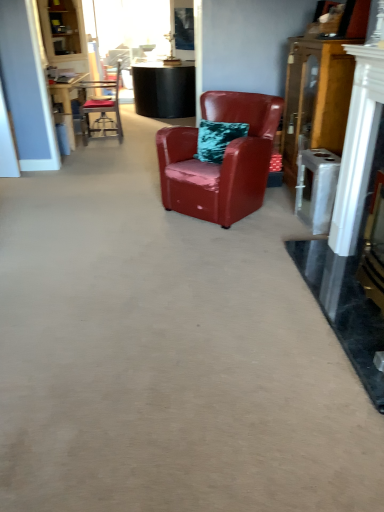
Question: From the image's perspective, is wooden cabinet at right above glossy leather armchair at center, which appears as the 2th chair when viewed from the back?

Choices:
 (A) no
 (B) yes

Answer: (B)

Question: Considering the relative sizes of wooden cabinet at right and glossy leather armchair at center, the 2th chair when ordered from left to right, in the image provided, is wooden cabinet at right smaller than glossy leather armchair at center, the 2th chair when ordered from left to right,?

Choices:
 (A) no
 (B) yes

Answer: (B)

Question: Is wooden cabinet at right to the left of glossy leather armchair at center, which is the first chair in right-to-left order, from the viewer's perspective?

Choices:
 (A) yes
 (B) no

Answer: (B)

Question: From a real-world perspective, is wooden cabinet at right over glossy leather armchair at center, the 2th chair when ordered from left to right?

Choices:
 (A) yes
 (B) no

Answer: (A)

Question: Is wooden cabinet at right behind glossy leather armchair at center, marked as the 2th chair in a top-to-bottom arrangement?

Choices:
 (A) no
 (B) yes

Answer: (B)

Question: Based on their sizes in the image, would you say wooden cabinet at right is bigger or smaller than glossy leather armchair at center, which appears as the 2th chair when viewed from the back?

Choices:
 (A) small
 (B) big

Answer: (A)

Question: Is point (302, 134) positioned closer to the camera than point (253, 202)?

Choices:
 (A) closer
 (B) farther

Answer: (B)

Question: Visually, is wooden cabinet at right positioned to the left or to the right of glossy leather armchair at center, which is the first chair in right-to-left order?

Choices:
 (A) left
 (B) right

Answer: (B)

Question: From a real-world perspective, relative to glossy leather armchair at center, which is the first chair in right-to-left order, is wooden cabinet at right vertically above or below?

Choices:
 (A) above
 (B) below

Answer: (A)

Question: In terms of size, does metallic silver chair at upper left, acting as the second chair starting from the bottom, appear bigger or smaller than glossy leather armchair at center, which is the first chair in right-to-left order?

Choices:
 (A) big
 (B) small

Answer: (B)

Question: Based on their positions, is metallic silver chair at upper left, which is the first chair from back to front, located to the left or right of glossy leather armchair at center, which appears as the 2th chair when viewed from the back?

Choices:
 (A) right
 (B) left

Answer: (B)

Question: From the image's perspective, is metallic silver chair at upper left, which is the second chair in right-to-left order, located above or below glossy leather armchair at center, the 2th chair when ordered from left to right?

Choices:
 (A) above
 (B) below

Answer: (A)

Question: Looking at their shapes, would you say metallic silver chair at upper left, acting as the second chair starting from the bottom, is wider or thinner than glossy leather armchair at center, marked as the 2th chair in a top-to-bottom arrangement?

Choices:
 (A) wide
 (B) thin

Answer: (B)

Question: From a real-world perspective, relative to wooden cabinet at right, is glossy leather armchair at center, marked as the 2th chair in a top-to-bottom arrangement, vertically above or below?

Choices:
 (A) above
 (B) below

Answer: (B)

Question: Is glossy leather armchair at center, the 2th chair when ordered from left to right, taller or shorter than wooden cabinet at right?

Choices:
 (A) tall
 (B) short

Answer: (B)